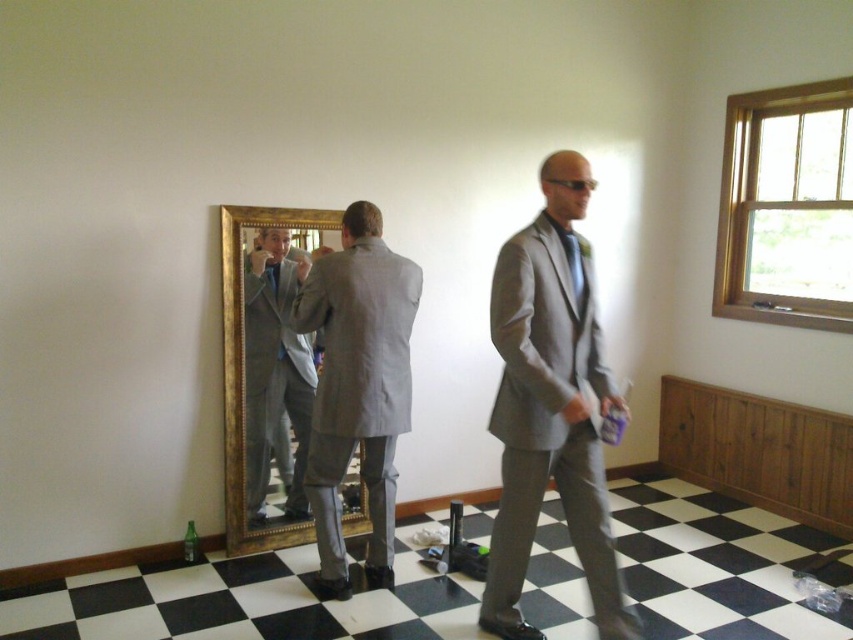
You are standing in the room and want to pick up an object from the floor. You see two points on the floor labeled as point [575,432] and point [570,257]. Which point is closer to you?

Point [575,432] is further to the camera than point [570,257], so point [570,257] is closer to you.